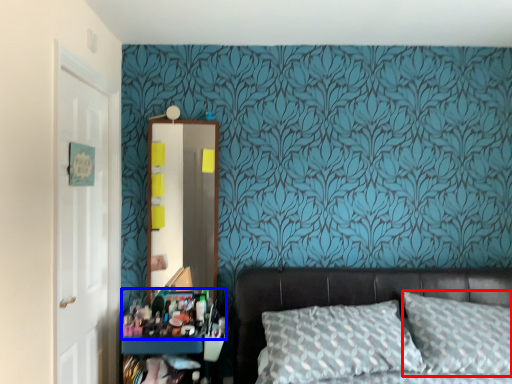
Question: Which object appears farthest to the camera in this image, pillow (highlighted by a red box) or stuff (highlighted by a blue box)?

Choices:
 (A) pillow
 (B) stuff

Answer: (B)